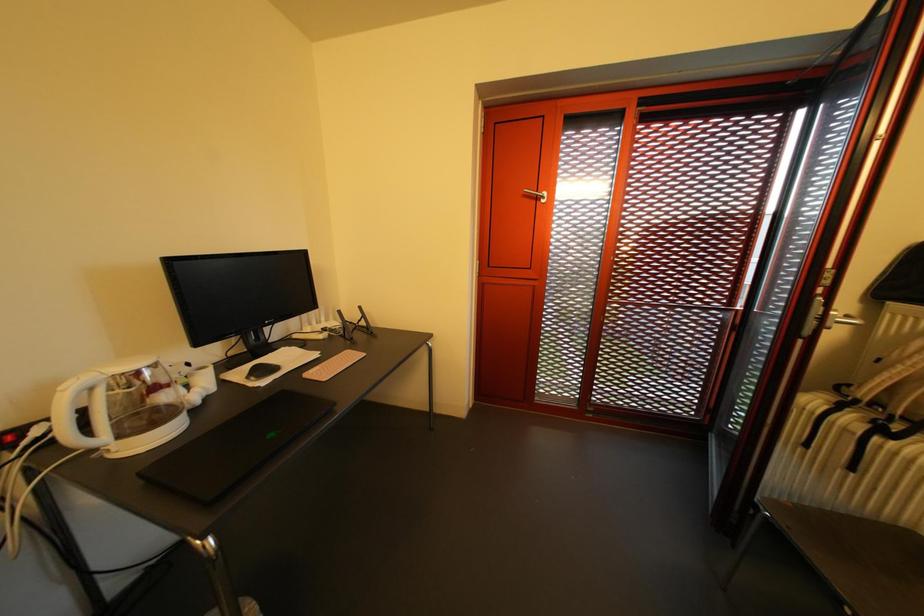
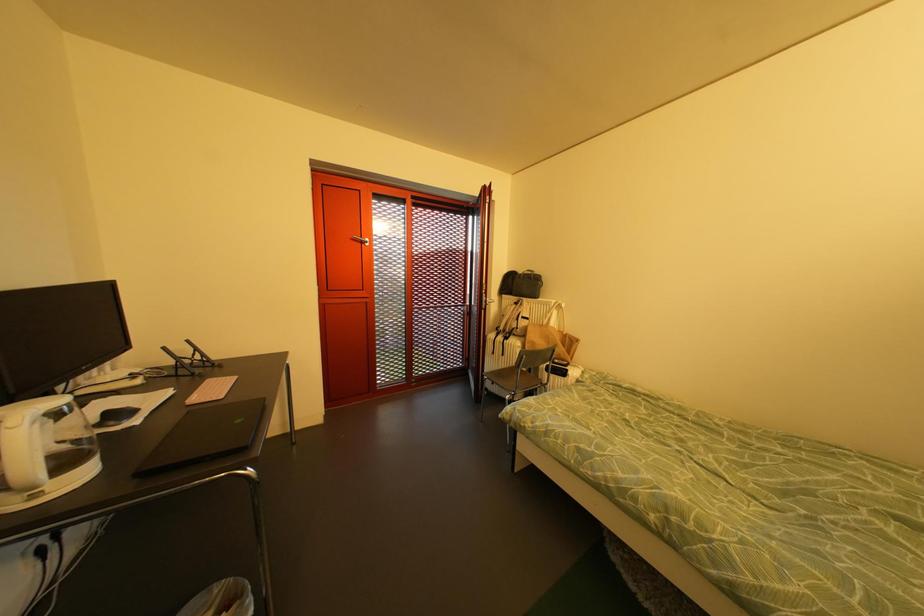
Question: The camera is either moving clockwise (left) or counter-clockwise (right) around the object. The first image is from the beginning of the video and the second image is from the end. Is the camera moving left or right when shooting the video?

Choices:
 (A) Left
 (B) Right

Answer: (A)